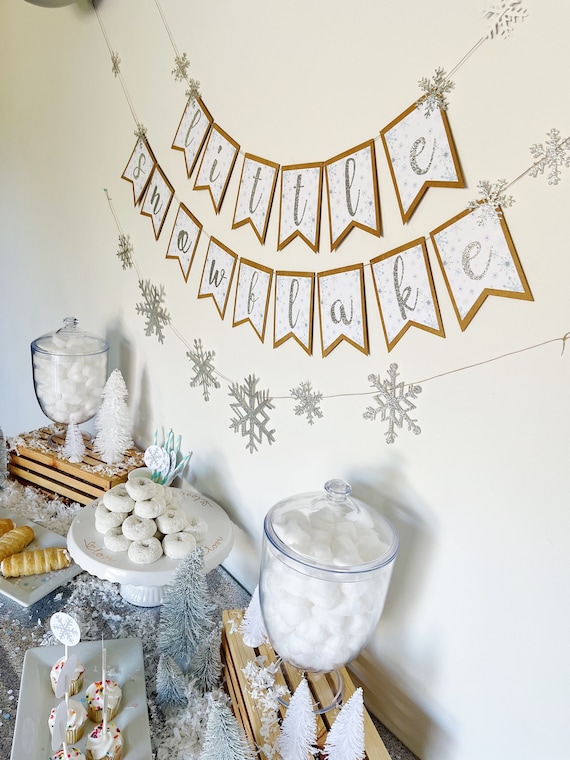
Identify the location of platter. (219, 526).